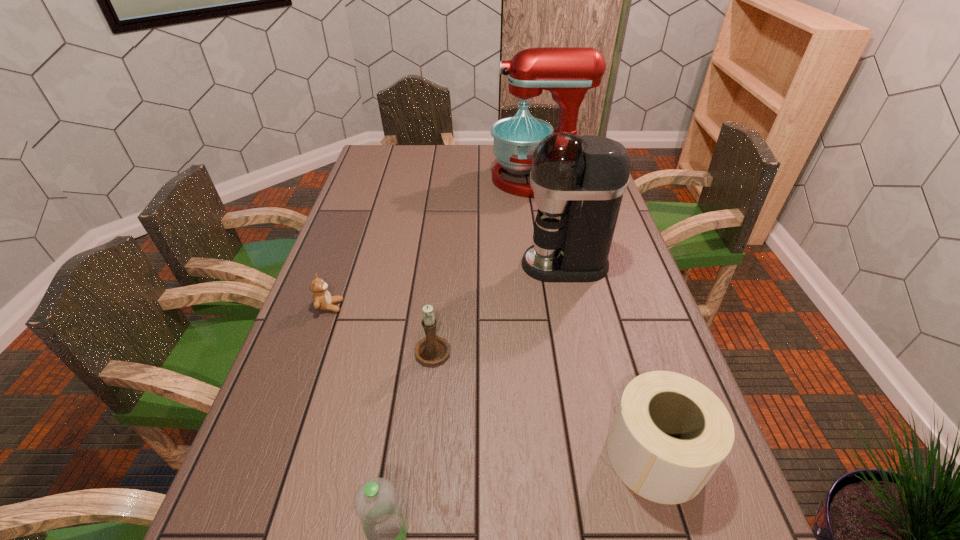
At what (x,y) coordinates should I click in order to perform the action: click on the farthest object. Please return your answer as a coordinate pair (x, y). Image resolution: width=960 pixels, height=540 pixels. Looking at the image, I should click on (567, 72).

The width and height of the screenshot is (960, 540). What are the coordinates of `the second tallest object` in the screenshot? It's located at tap(578, 182).

Locate an element on the screen. the fifth nearest object is located at coordinates (578, 182).

In order to click on the third nearest object in this screenshot , I will do `click(433, 349)`.

The height and width of the screenshot is (540, 960). What are the coordinates of `toilet tissue` in the screenshot? It's located at (670, 433).

At what (x,y) coordinates should I click in order to perform the action: click on the shortest object. Please return your answer as a coordinate pair (x, y). Image resolution: width=960 pixels, height=540 pixels. Looking at the image, I should click on (322, 300).

At what (x,y) coordinates should I click in order to perform the action: click on teddy bear. Please return your answer as a coordinate pair (x, y). This screenshot has width=960, height=540. Looking at the image, I should click on (322, 300).

Image resolution: width=960 pixels, height=540 pixels. In order to click on free region located on the front-facing side of the mixer in this screenshot , I will do `click(476, 179)`.

Locate an element on the screen. vacant region located 0.150m on the front-facing side of the mixer is located at coordinates (450, 179).

Where is `free region located 0.240m on the front-facing side of the mixer`? free region located 0.240m on the front-facing side of the mixer is located at coordinates (426, 179).